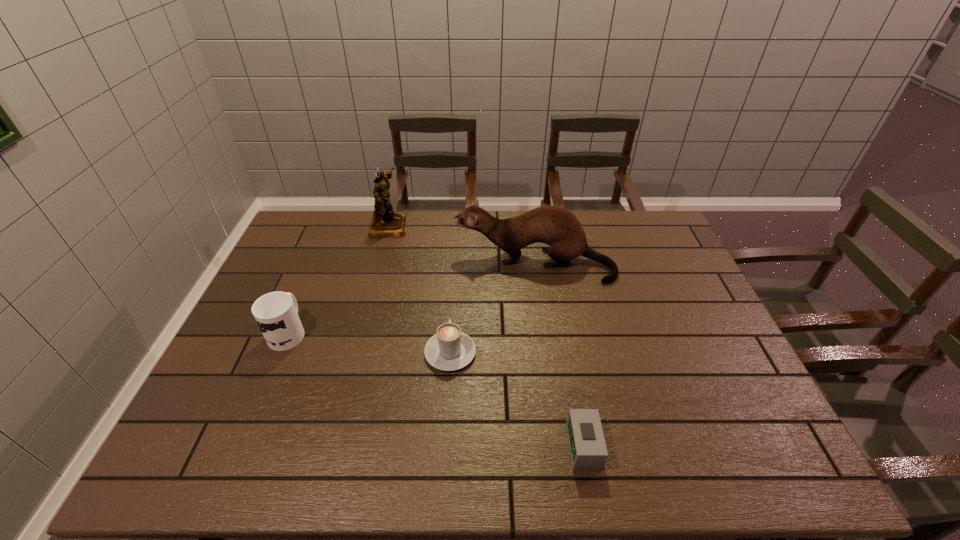
You are a GUI agent. You are given a task and a screenshot of the screen. Output one action in this format:
    pyautogui.click(x=<x>, y=<y>)
    Task: Click on the free space located at the face of the ferret
    This screenshot has height=540, width=960.
    Given the screenshot: What is the action you would take?
    pyautogui.click(x=381, y=264)

Identify the location of free space located 0.110m at the face of the ferret. (420, 264).

The width and height of the screenshot is (960, 540). I want to click on vacant region located at the face of the ferret, so click(x=433, y=264).

Locate an element on the screen. blank space located on the handle side of the third tallest object is located at coordinates (321, 255).

This screenshot has width=960, height=540. Find the location of `vacant space located on the handle side of the third tallest object`. vacant space located on the handle side of the third tallest object is located at coordinates (328, 236).

Identify the location of free location located on the handle side of the third tallest object. The image size is (960, 540). (323, 250).

I want to click on free point located 0.170m to the right of the cappuccino, so click(454, 291).

Where is `vacant space positioned 0.130m to the right of the cappuccino`? The image size is (960, 540). vacant space positioned 0.130m to the right of the cappuccino is located at coordinates (453, 300).

I want to click on blank space located 0.370m to the right of the cappuccino, so click(457, 250).

Image resolution: width=960 pixels, height=540 pixels. In order to click on blank area located 0.340m on the front-facing side of the shortest object in this screenshot , I will do [416, 447].